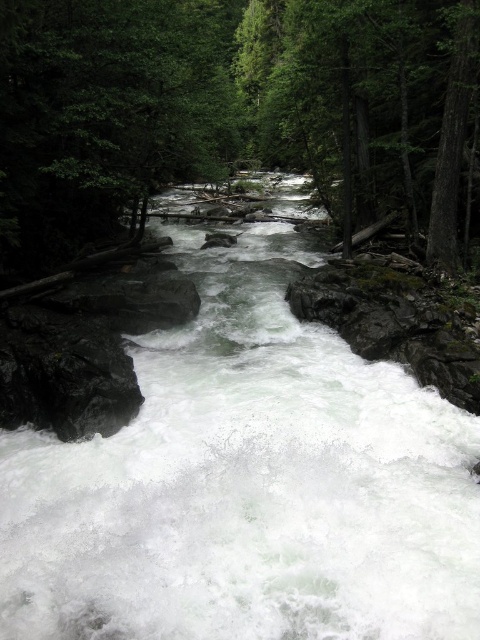
You are standing at the edge of the river and see two points in the scene, point (327, 458) and point (202, 157). Which point is nearer to you?

Point (327, 458) is closer to the viewer than point (202, 157).

You are a hiker trying to cross the river using the rocks. You notice the white frothy water at center and the green matte tree at center. Which one is wider from your perspective?

The green matte tree at center is wider than the white frothy water at center.

You are a hiker standing near the river and want to know which object is taller between the white frothy water at center and the green matte tree at center. Based on the scene, can you determine which one is taller?

The white frothy water at center has a lesser height compared to the green matte tree at center, so the green matte tree at center is taller.